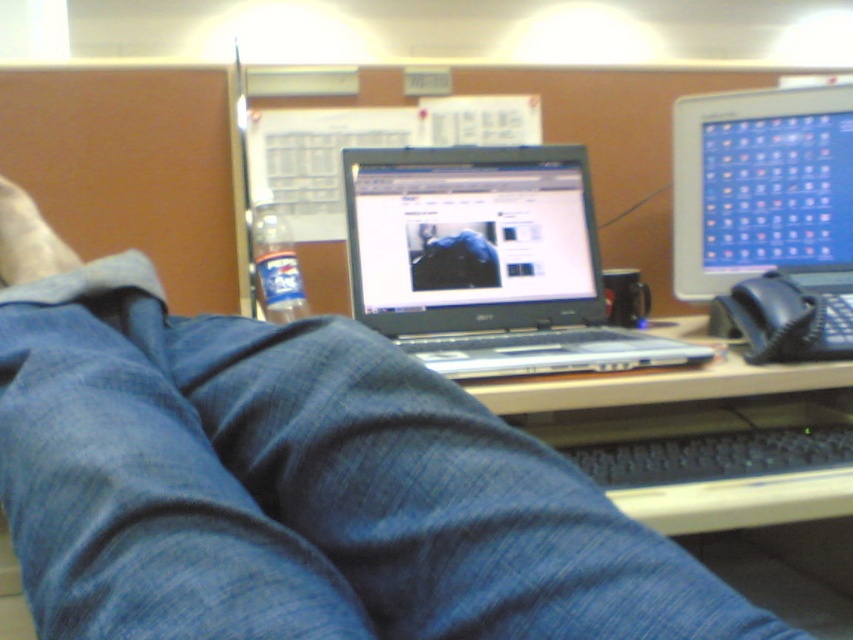
You are an office cleaner assigned to clean the desk in the cubicle. You need to move the denim pants at lower center and the sleek silver laptop at center to access the desk surface. According to the setup, which object is located underneath the other?

The denim pants at lower center is positioned under the sleek silver laptop at center, so the denim pants are underneath the laptop.

You are an office inspector checking for proper workspace ergonomics. You notice the denim pants at lower center and the white fabric foot at lower left. Which object is wider in this setup?

The denim pants at lower center is wider than the white fabric foot at lower left.

You are an office worker who needs to reach the matte plastic monitor at upper right but there is a sleek silver laptop at center in the way. Can you move the laptop to access the monitor?

The sleek silver laptop at center is in front of the matte plastic monitor at upper right, so you can move the laptop to access the monitor.